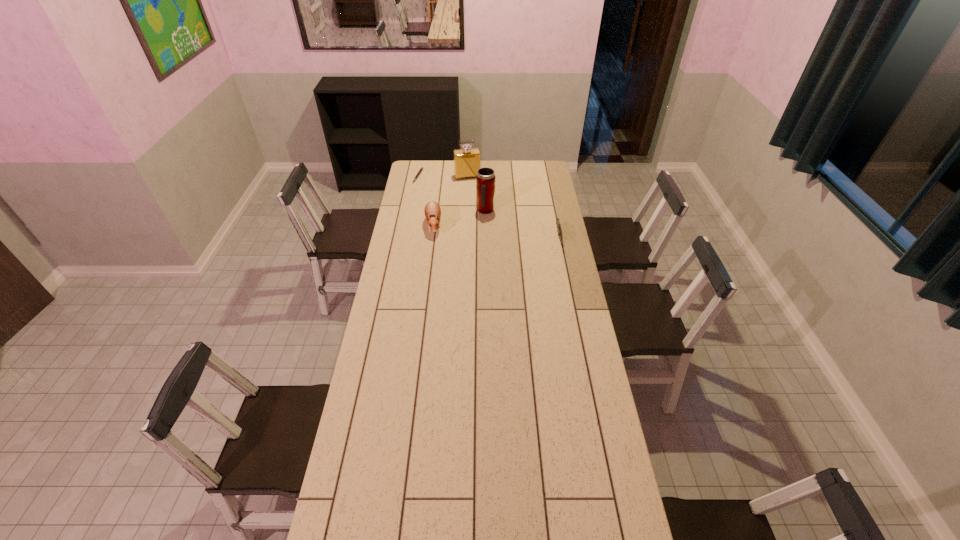
Locate an element on the screen. pen positioned at the far edge is located at coordinates (421, 168).

Locate an element on the screen. hamster that is at the left edge is located at coordinates (432, 210).

You are a GUI agent. You are given a task and a screenshot of the screen. Output one action in this format:
    pyautogui.click(x=<x>, y=<y>)
    Task: Click on the pen at the left edge
    
    Given the screenshot: What is the action you would take?
    pyautogui.click(x=421, y=168)

Locate an element on the screen. The height and width of the screenshot is (540, 960). object that is at the right edge is located at coordinates (558, 224).

This screenshot has width=960, height=540. I want to click on object present at the far left corner, so click(x=421, y=168).

Identify the location of free region at the far edge. Image resolution: width=960 pixels, height=540 pixels. 521,164.

At what (x,y) coordinates should I click in order to perform the action: click on vacant space at the left edge. Please return your answer as a coordinate pair (x, y). The image size is (960, 540). Looking at the image, I should click on (423, 246).

At what (x,y) coordinates should I click in order to perform the action: click on vacant space at the right edge. Please return your answer as a coordinate pair (x, y). The width and height of the screenshot is (960, 540). Looking at the image, I should click on (581, 338).

Locate an element on the screen. vacant space at the far left corner of the desktop is located at coordinates (426, 175).

I want to click on vacant space at the near right corner of the desktop, so click(610, 528).